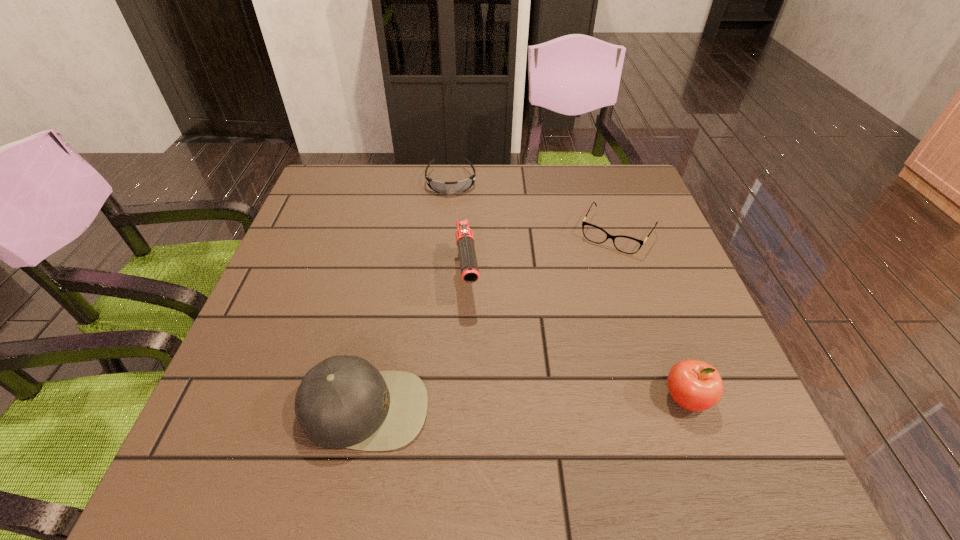
At what (x,y) coordinates should I click in order to perform the action: click on vacant space situated 0.180m at the aiming end of the gun. Please return your answer as a coordinate pair (x, y). Looking at the image, I should click on (478, 383).

In order to click on vacant space located 0.120m at the aiming end of the gun in this screenshot , I will do `click(475, 357)`.

This screenshot has height=540, width=960. In order to click on vacant space located on the lenses of the farthest object in this screenshot , I will do `click(459, 245)`.

At what (x,y) coordinates should I click in order to perform the action: click on blank area located on the lenses of the farthest object. Please return your answer as a coordinate pair (x, y). The height and width of the screenshot is (540, 960). Looking at the image, I should click on (459, 245).

What are the coordinates of `free space located 0.230m on the lenses of the farthest object` in the screenshot? It's located at (460, 250).

Locate an element on the screen. Image resolution: width=960 pixels, height=540 pixels. spectacles that is at the far edge is located at coordinates (629, 245).

This screenshot has height=540, width=960. In order to click on sunglasses positioned at the far edge in this screenshot , I will do [x=461, y=186].

The image size is (960, 540). In order to click on cap at the near edge in this screenshot , I will do `click(342, 402)`.

I want to click on apple located at the near edge, so click(x=694, y=385).

Identify the location of object present at the left edge. (342, 402).